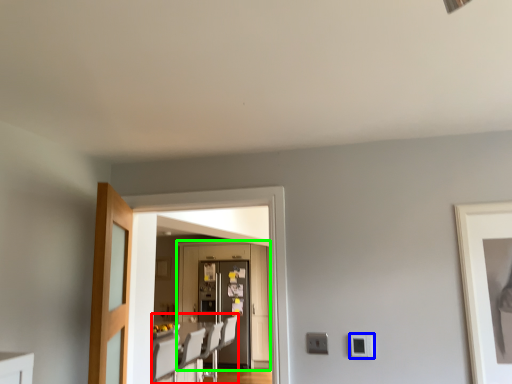
Question: Which is nearer to the furniture (highlighted by a red box)? light switch (highlighted by a blue box) or door (highlighted by a green box).

Choices:
 (A) light switch
 (B) door

Answer: (B)